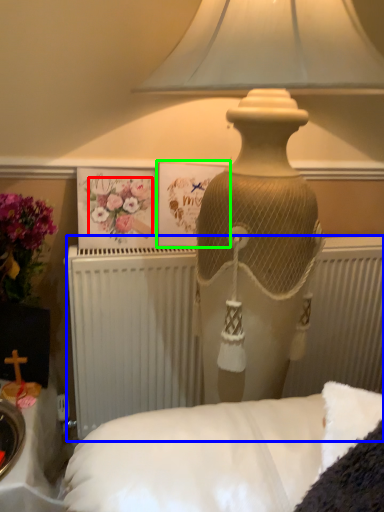
Question: Estimate the real-world distances between objects in this image. Which object is closer to flower (highlighted by a red box), radiator (highlighted by a blue box) or postcard (highlighted by a green box)?

Choices:
 (A) radiator
 (B) postcard

Answer: (B)